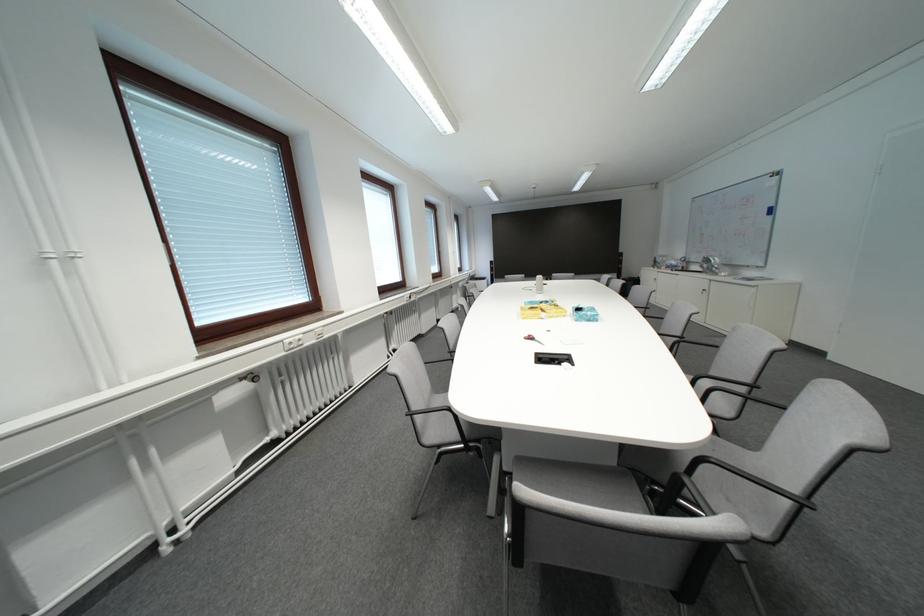
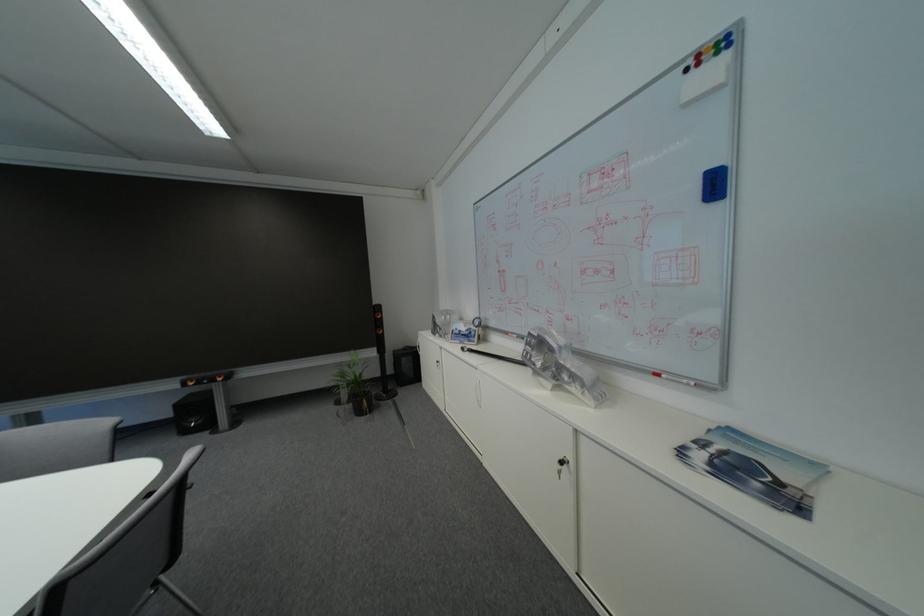
Locate, in the second image, the point that corresponds to (x=781, y=214) in the first image.

(726, 188)